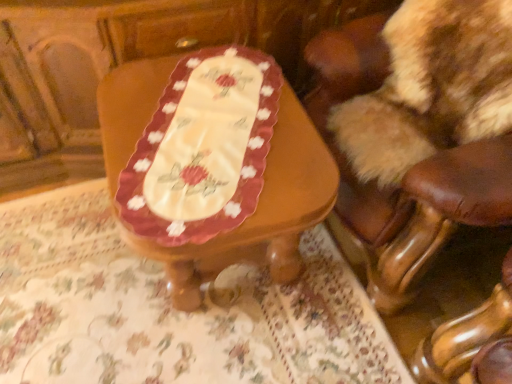
Question: Do you think wooden table at center is within beige fabric tablecloth at center, or outside of it?

Choices:
 (A) outside
 (B) inside

Answer: (A)

Question: Is wooden table at center in front of or behind beige fabric tablecloth at center in the image?

Choices:
 (A) front
 (B) behind

Answer: (A)

Question: Considering the real-world distances, which object is farthest from the brown leather chair at upper right?

Choices:
 (A) wooden table at center
 (B) beige fabric tablecloth at center

Answer: (B)

Question: Estimate the real-world distances between objects in this image. Which object is farther from the wooden table at center?

Choices:
 (A) beige fabric tablecloth at center
 (B) brown leather chair at upper right

Answer: (A)